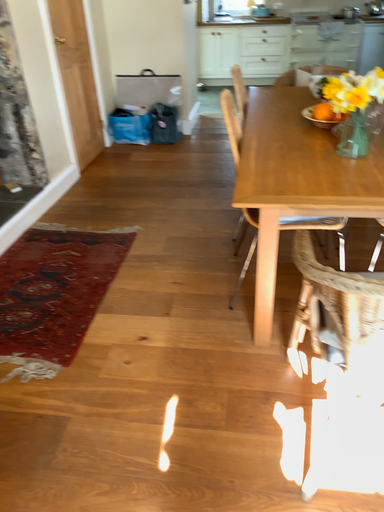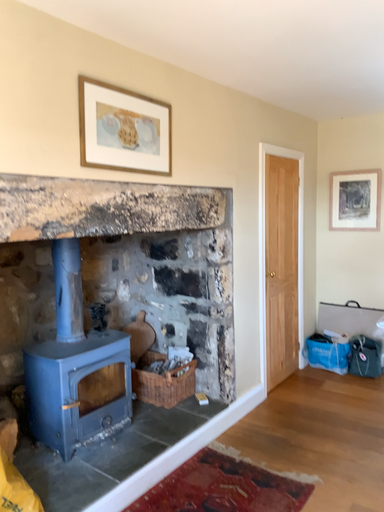
Question: How did the camera likely rotate when shooting the video?

Choices:
 (A) rotated right
 (B) rotated left

Answer: (B)